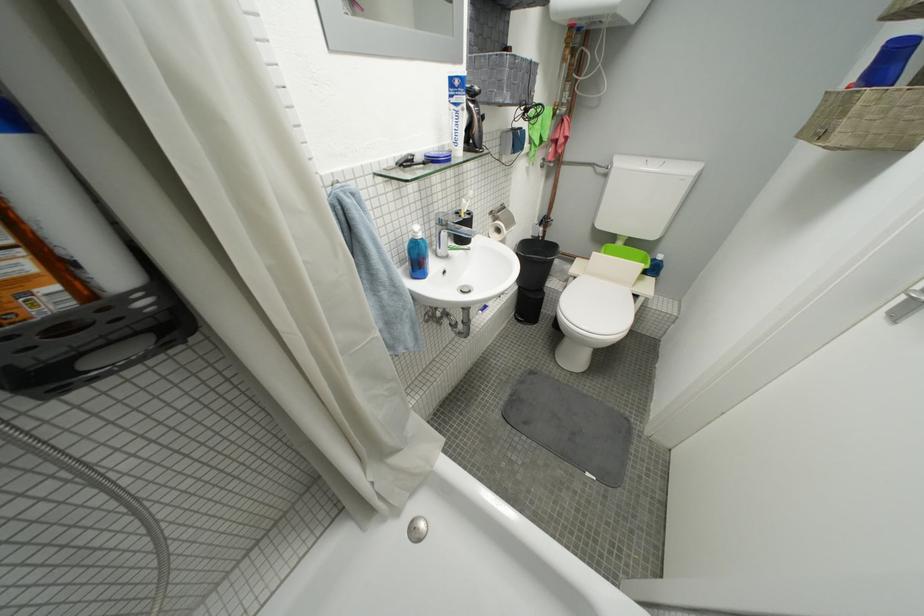
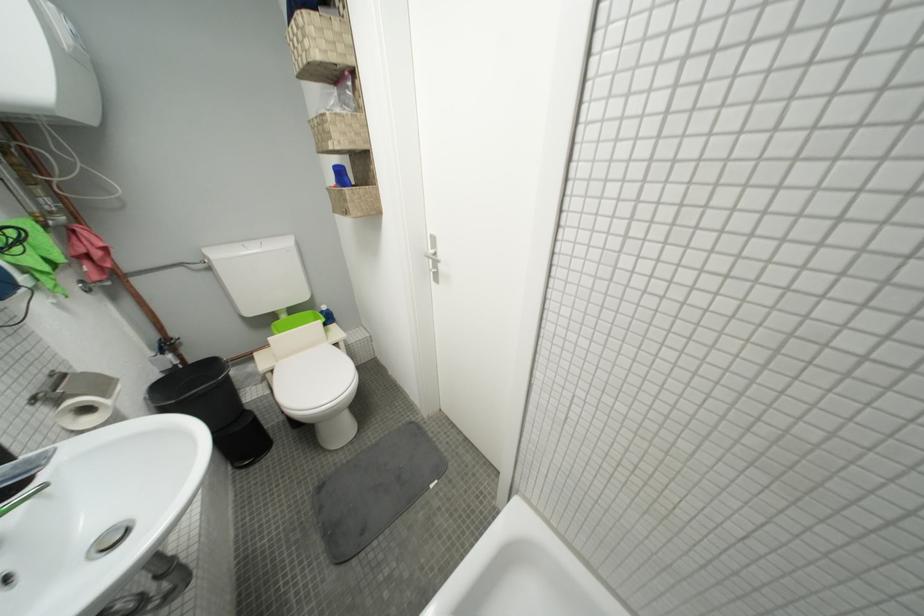
The point at (472, 288) is marked in the first image. Where is the corresponding point in the second image?

(107, 541)